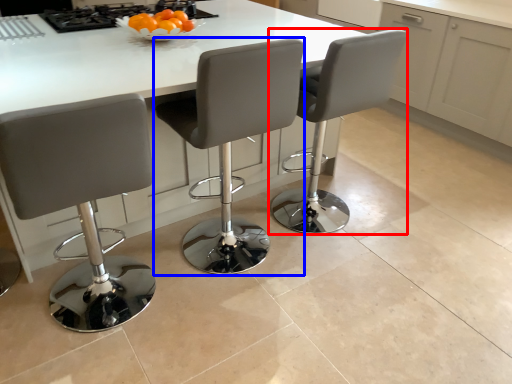
Question: Among these objects, which one is nearest to the camera, chair (highlighted by a red box) or chair (highlighted by a blue box)?

Choices:
 (A) chair
 (B) chair

Answer: (B)